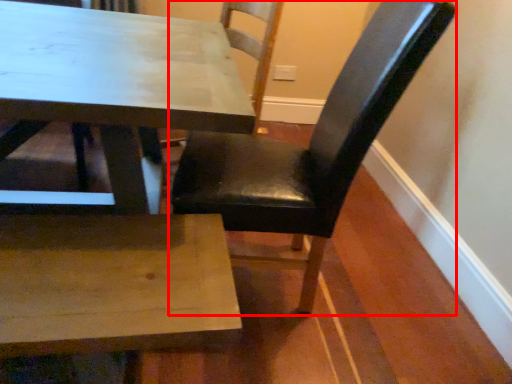
Question: From the image's perspective, where is chair (annotated by the red box) located in relation to chair in the image?

Choices:
 (A) above
 (B) below

Answer: (B)